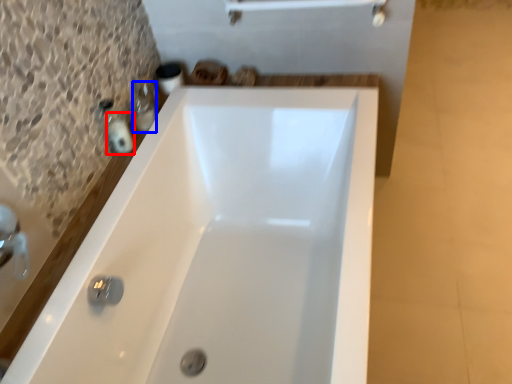
Question: Which object is closer to the camera taking this photo, toiletry (highlighted by a red box) or toiletry (highlighted by a blue box)?

Choices:
 (A) toiletry
 (B) toiletry

Answer: (A)